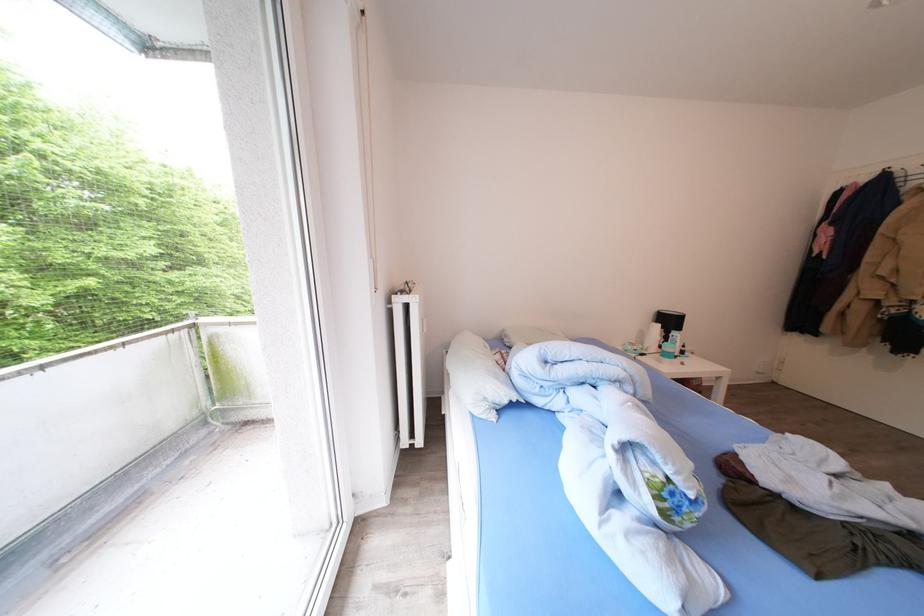
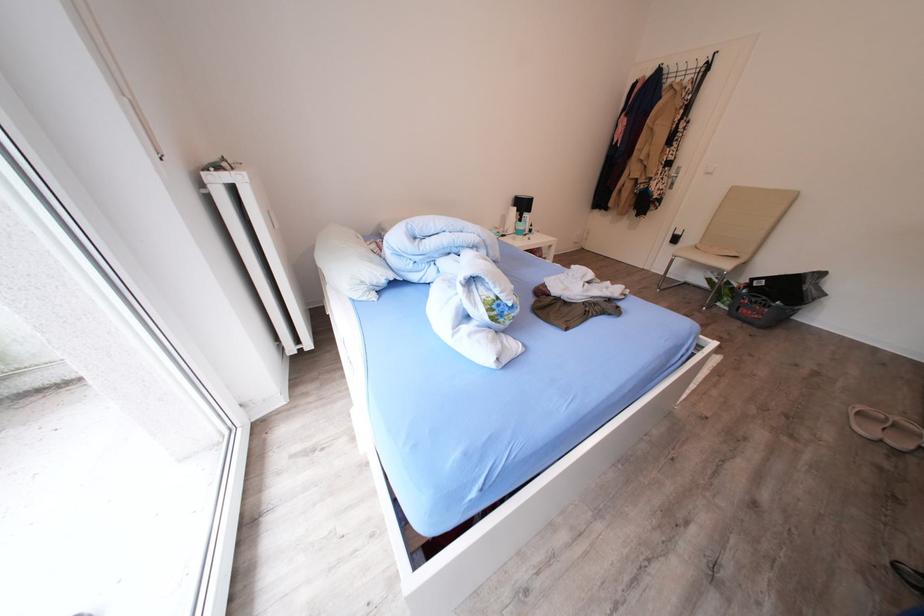
Based on the continuous images, in which direction is the camera rotating?

The rotation direction of the camera is right-down.